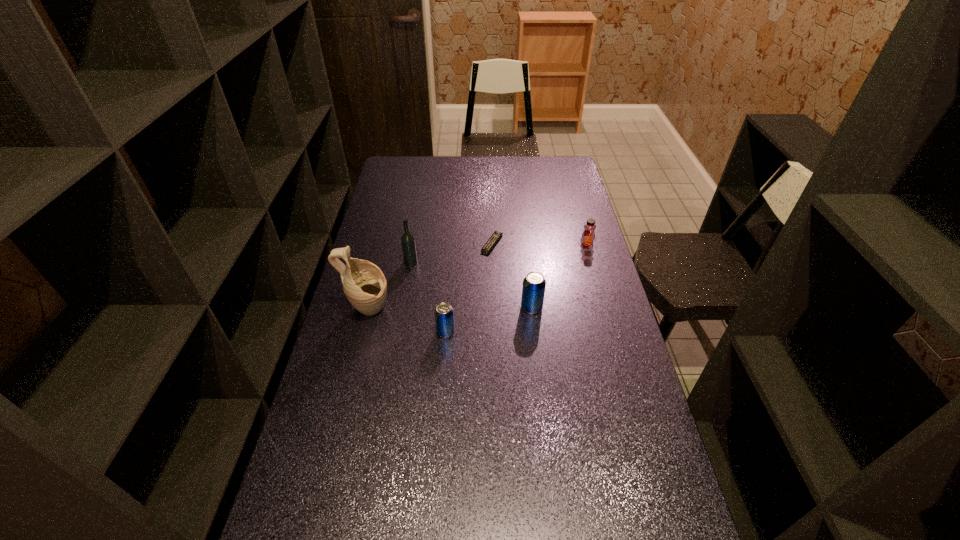
Observe the arrangement of all beer cans in the image. To keep them evenly spaced, where would you place another beer can on the right? Please locate a free space. Please provide its 2D coordinates. Your answer should be formatted as a tuple, i.e. [(x, y)], where the tuple contains the x and y coordinates of a point satisfying the conditions above.

[(610, 286)]